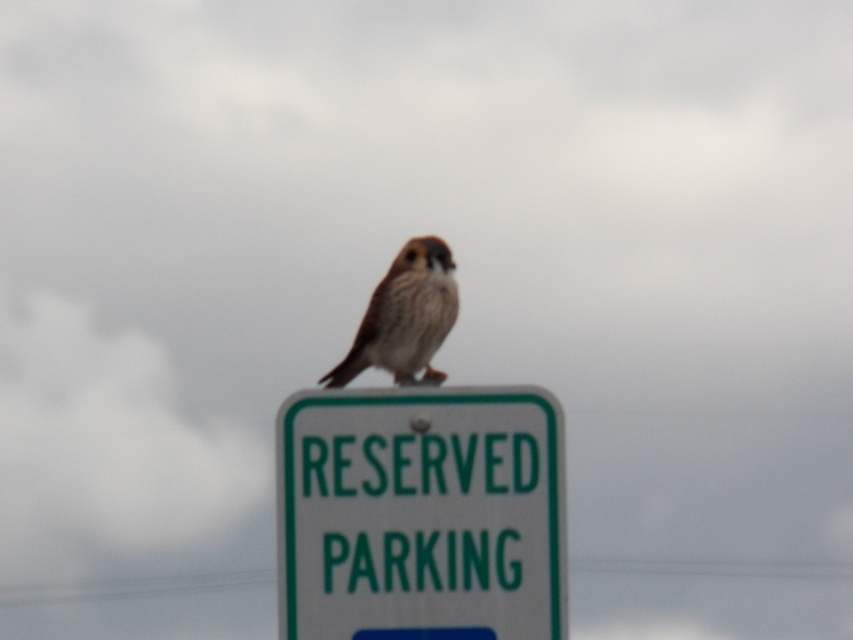
Based on the photo, is green plastic sign at center to the right of brown feathered bird at center from the viewer's perspective?

Indeed, green plastic sign at center is positioned on the right side of brown feathered bird at center.

Is point (378, 588) farther from camera compared to point (363, 332)?

No, (378, 588) is in front of (363, 332).

Identify the location of green plastic sign at center. (421, 515).

Image resolution: width=853 pixels, height=640 pixels. Identify the location of green plastic sign at center. pyautogui.click(x=421, y=515).

Measure the distance between green plastic sign at center and green plastic power line at lower center.

A distance of 5.56 meters exists between green plastic sign at center and green plastic power line at lower center.

Who is higher up, green plastic sign at center or green plastic power line at lower center?

green plastic sign at center

Is point (286, 420) closer to viewer compared to point (784, 570)?

That is True.

Find the location of `green plastic sign at center`. green plastic sign at center is located at coordinates 421,515.

Is brown feathered bird at center smaller than green plastic power line at lower center?

Yes.

Between brown feathered bird at center and green plastic power line at lower center, which one appears on the right side from the viewer's perspective?

From the viewer's perspective, brown feathered bird at center appears more on the right side.

Image resolution: width=853 pixels, height=640 pixels. What do you see at coordinates (404, 316) in the screenshot? I see `brown feathered bird at center` at bounding box center [404, 316].

I want to click on brown feathered bird at center, so click(x=404, y=316).